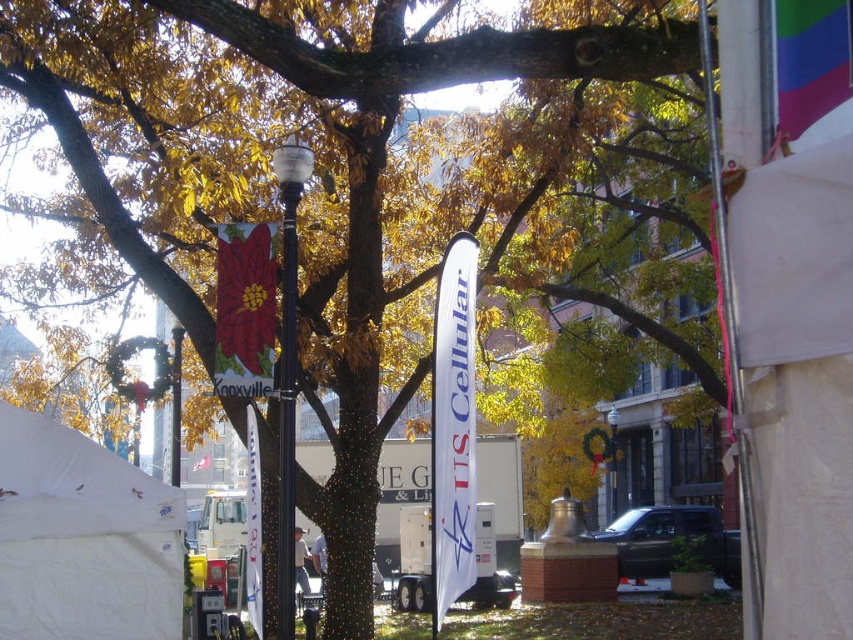
Question: Which point is farther from the camera taking this photo?

Choices:
 (A) (x=438, y=625)
 (B) (x=57, y=579)
 (C) (x=283, y=460)
 (D) (x=172, y=401)

Answer: (D)

Question: Which object is the farthest from the white fabric tent at lower left?

Choices:
 (A) white fabric banner at center
 (B) metallic lamp post at center
 (C) black polished pole at center

Answer: (A)

Question: Is white fabric tent at lower left positioned in front of white fabric banner at center?

Choices:
 (A) no
 (B) yes

Answer: (A)

Question: Which object is positioned closest to the metallic lamp post at center?

Choices:
 (A) black polished pole at center
 (B) white fabric tent at lower left

Answer: (B)

Question: Does metallic lamp post at center have a lesser width compared to black polished pole at center?

Choices:
 (A) no
 (B) yes

Answer: (B)

Question: Does white fabric banner at center have a smaller size compared to metallic lamp post at center?

Choices:
 (A) no
 (B) yes

Answer: (B)